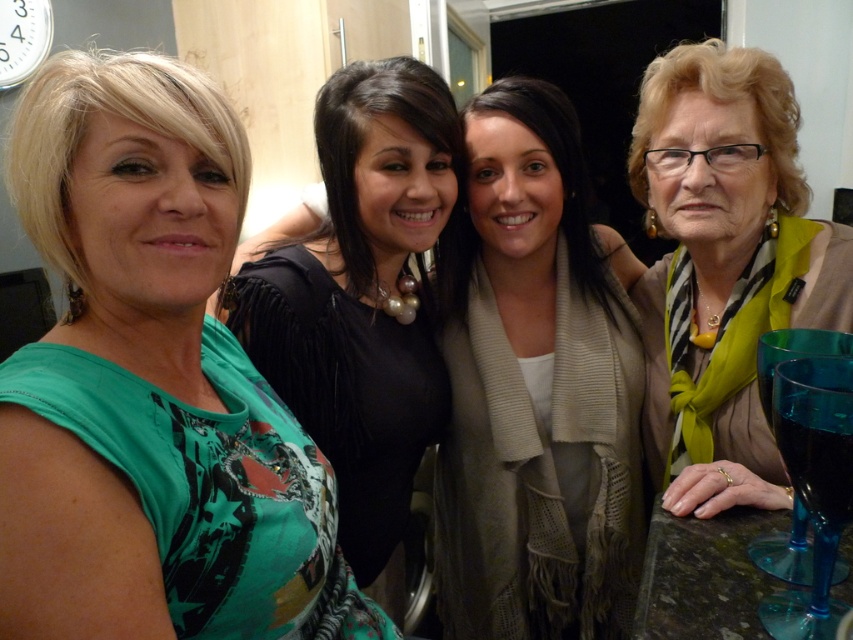
Who is lower down, green printed dress at left or green silk scarf at right?

green printed dress at left is below.

Looking at this image, is green printed dress at left bigger than green silk scarf at right?

Yes, green printed dress at left is bigger than green silk scarf at right.

Between point (57, 381) and point (784, 147), which one is positioned in front?

Point (57, 381) is more forward.

Where is `green printed dress at left`? The width and height of the screenshot is (853, 640). green printed dress at left is located at coordinates (151, 387).

Does light beige scarf at center have a smaller size compared to black matte dress at center?

Indeed, light beige scarf at center has a smaller size compared to black matte dress at center.

Where is `light beige scarf at center`? The width and height of the screenshot is (853, 640). light beige scarf at center is located at coordinates (535, 387).

Locate an element on the screen. light beige scarf at center is located at coordinates (535, 387).

Does green silk scarf at right have a lesser height compared to transparent blue wine glass at lower right?

No, green silk scarf at right is not shorter than transparent blue wine glass at lower right.

Can you confirm if green silk scarf at right is positioned to the right of transparent blue wine glass at lower right?

Correct, you'll find green silk scarf at right to the right of transparent blue wine glass at lower right.

Image resolution: width=853 pixels, height=640 pixels. Describe the element at coordinates (724, 268) in the screenshot. I see `green silk scarf at right` at that location.

Where is `green silk scarf at right`? green silk scarf at right is located at coordinates (724, 268).